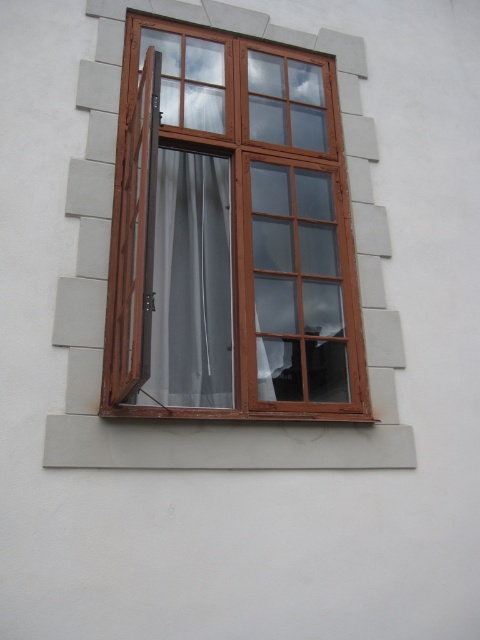
Question: Does brown wooden window at center appear over satin gray curtain at center?

Choices:
 (A) yes
 (B) no

Answer: (A)

Question: Among these objects, which one is nearest to the camera?

Choices:
 (A) brown wooden window at center
 (B) satin gray curtain at center

Answer: (A)

Question: Is the position of brown wooden window at center less distant than that of satin gray curtain at center?

Choices:
 (A) no
 (B) yes

Answer: (B)

Question: From the image, what is the correct spatial relationship of brown wooden window at center in relation to satin gray curtain at center?

Choices:
 (A) left
 (B) right

Answer: (B)